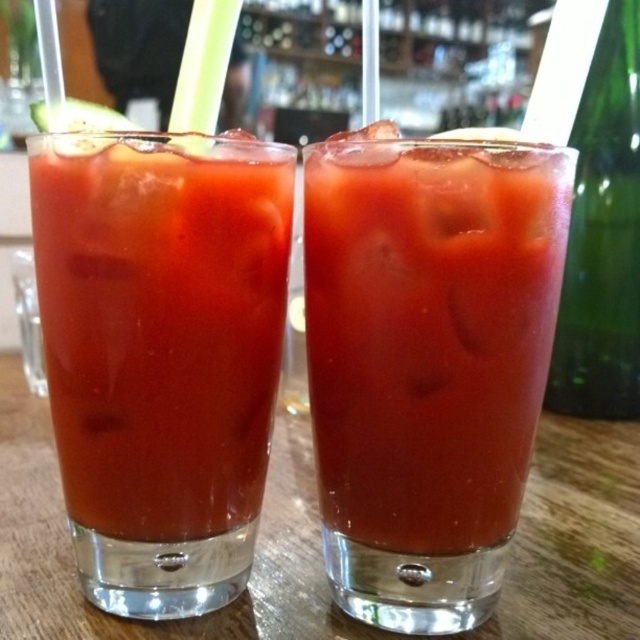
Question: Is matte glass at center below green glass bottle at right?

Choices:
 (A) yes
 (B) no

Answer: (A)

Question: Does matte glass at center appear over translucent glass at center?

Choices:
 (A) yes
 (B) no

Answer: (B)

Question: Which object appears farthest from the camera in this image?

Choices:
 (A) matte glass at center
 (B) translucent glass at center
 (C) green glass bottle at right

Answer: (C)

Question: Among these objects, which one is nearest to the camera?

Choices:
 (A) translucent glass at center
 (B) green glass bottle at right
 (C) matte glass at center

Answer: (C)

Question: Observing the image, what is the correct spatial positioning of translucent glass at center in reference to green glass bottle at right?

Choices:
 (A) below
 (B) above

Answer: (A)

Question: Which point appears closest to the camera in this image?

Choices:
 (A) (60, 449)
 (B) (616, 104)
 (C) (326, 397)

Answer: (C)